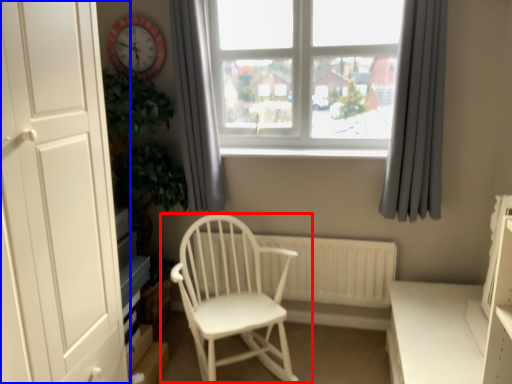
Question: Among these objects, which one is nearest to the camera, chair (highlighted by a red box) or door (highlighted by a blue box)?

Choices:
 (A) chair
 (B) door

Answer: (B)